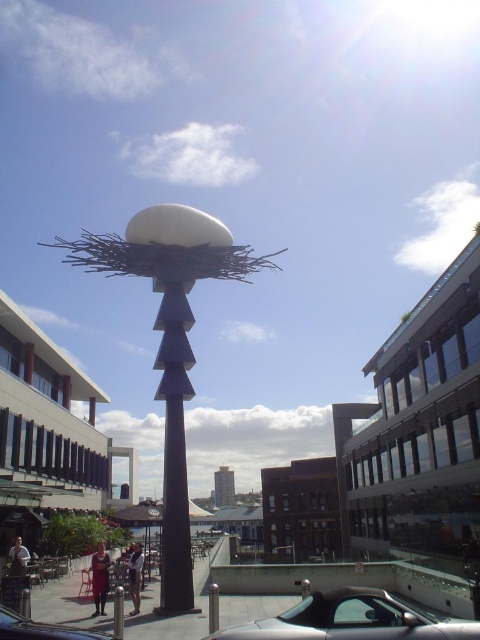
You are a photographer trying to capture both the matte white sculpture at center and the shiny silver car at lower center in the same frame. Based on their sizes, which object should you position closer to the camera to ensure both fit well in the photo?

Since the matte white sculpture at center is wider than the shiny silver car at lower center, you should position the wider matte white sculpture at center closer to the camera. This will help both objects fit better in the frame as closer objects appear larger, balancing their sizes in the photo.

You are a city planner designing a walking path between the matte white sculpture at center and the black polished stone pole at center. The path must be at least 3 feet wide to accommodate wheelchair access. Can the path be placed between them without making them too close?

The matte white sculpture at center and black polished stone pole at center are 36.93 inches apart from each other. Since 36.93 inches is approximately 3.08 feet, the path can be placed between them as it meets the minimum 3 feet width requirement.

You are a visitor in the plaza and want to take a photo of the matte white sculpture at center without the shiny black car at lower left blocking the view. Where should you position yourself relative to the car?

The matte white sculpture at center is below the shiny black car at lower left, so you should position yourself behind the shiny black car at lower left to avoid it blocking the view.